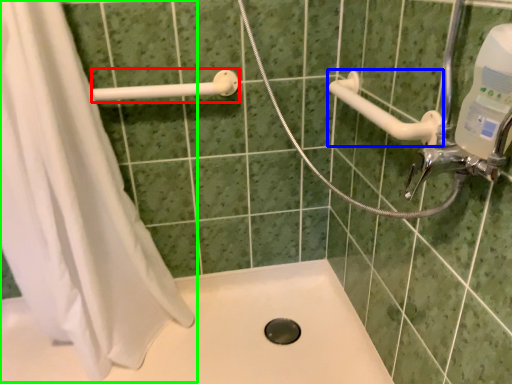
Question: Which object is positioned farthest from shower (highlighted by a red box)? Select from shower (highlighted by a blue box) and shower curtain (highlighted by a green box).

Choices:
 (A) shower
 (B) shower curtain

Answer: (A)